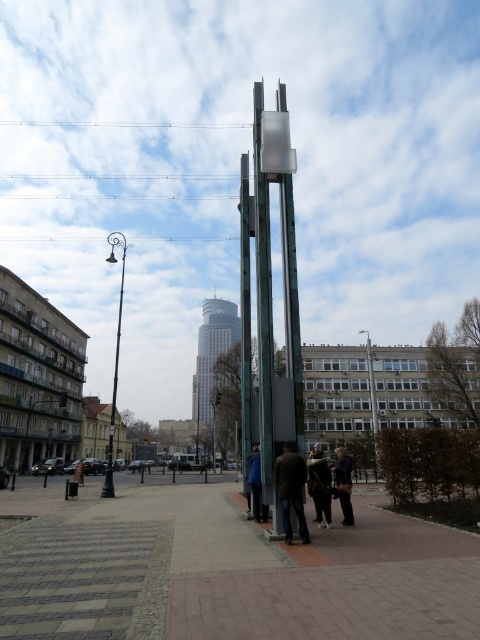
You are a delivery person who needs to place a small package on the ground near the dark brown fur coat at lower center and the dark purple jacket at lower right. Which of these two items can you place the package next to without it being immediately hidden from view?

The dark brown fur coat at lower center is smaller in size compared to the dark purple jacket at lower right. Therefore, placing the package next to the dark brown fur coat at lower center would be less likely to be hidden since it is smaller and offers less obstruction.

Based on the photo, you are a photographer standing in the urban scene and want to capture both the dark brown leather jacket at center and the dark purple jacket at lower right in your shot. Which jacket will appear closer to the camera in the photo?

→ The dark brown leather jacket at center will appear closer to the camera because it is positioned in front of the dark purple jacket at lower right.